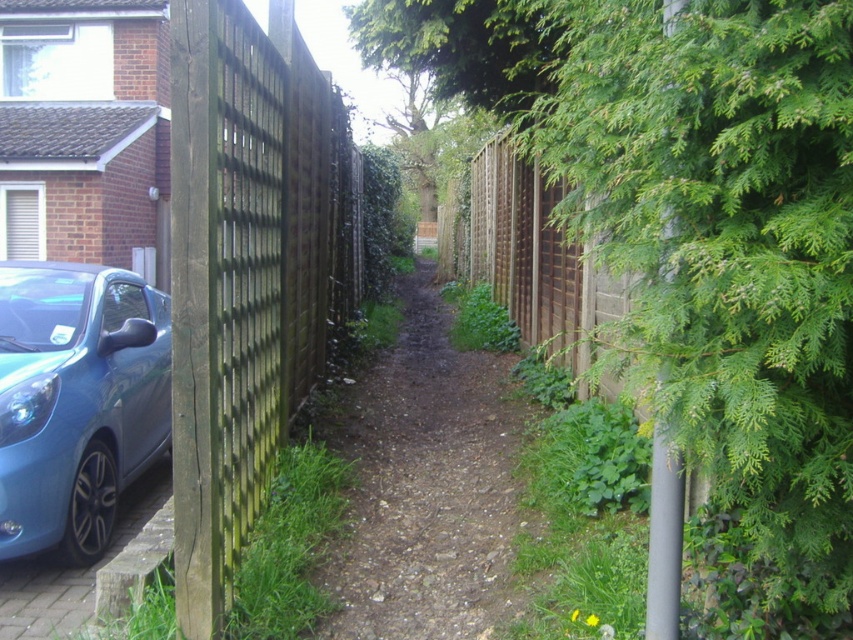
Question: Which of the following is the farthest from the observer?

Choices:
 (A) green leafy tree at center
 (B) green weathered wood fence at left
 (C) metallic blue car at lower left
 (D) matte blue car at lower left

Answer: (B)

Question: Which object is the closest to the green leafy tree at center?

Choices:
 (A) green weathered wood fence at left
 (B) metallic blue car at lower left

Answer: (B)

Question: Observing the image, what is the correct spatial positioning of green leafy tree at center in reference to matte blue car at lower left?

Choices:
 (A) above
 (B) below

Answer: (A)

Question: Is green weathered wood fence at left to the left of dirt/gravel path at center from the viewer's perspective?

Choices:
 (A) yes
 (B) no

Answer: (A)

Question: Considering the relative positions of green weathered wood fence at left and dirt/gravel path at center in the image provided, where is green weathered wood fence at left located with respect to dirt/gravel path at center?

Choices:
 (A) left
 (B) right

Answer: (A)

Question: Estimate the real-world distances between objects in this image. Which object is closer to the metallic blue car at lower left?

Choices:
 (A) dirt/gravel path at center
 (B) green weathered wood fence at left
 (C) matte blue car at lower left

Answer: (C)